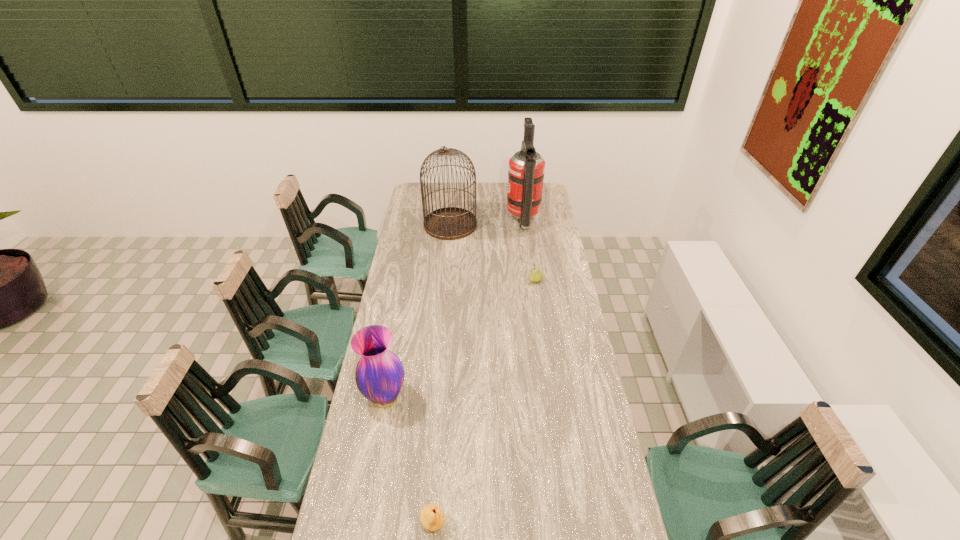
Locate an element on the screen. Image resolution: width=960 pixels, height=540 pixels. fire extinguisher is located at coordinates (526, 169).

Where is `birdcage`? Image resolution: width=960 pixels, height=540 pixels. birdcage is located at coordinates (449, 223).

Identify the location of the second nearest object. The image size is (960, 540). (379, 375).

The width and height of the screenshot is (960, 540). I want to click on vase, so click(379, 375).

Where is `the right pear`? the right pear is located at coordinates (535, 275).

Locate an element on the screen. This screenshot has width=960, height=540. the third nearest object is located at coordinates (535, 275).

Locate an element on the screen. The height and width of the screenshot is (540, 960). the nearer pear is located at coordinates (432, 518).

Where is `the nearest object`? The height and width of the screenshot is (540, 960). the nearest object is located at coordinates (432, 518).

You are a GUI agent. You are given a task and a screenshot of the screen. Output one action in this format:
    pyautogui.click(x=<x>, y=<y>)
    Task: Click on the free space located 0.140m on the front label side of the fire extinguisher
    The width and height of the screenshot is (960, 540).
    Given the screenshot: What is the action you would take?
    pyautogui.click(x=481, y=221)

The height and width of the screenshot is (540, 960). I want to click on vacant area situated on the front label side of the fire extinguisher, so click(451, 221).